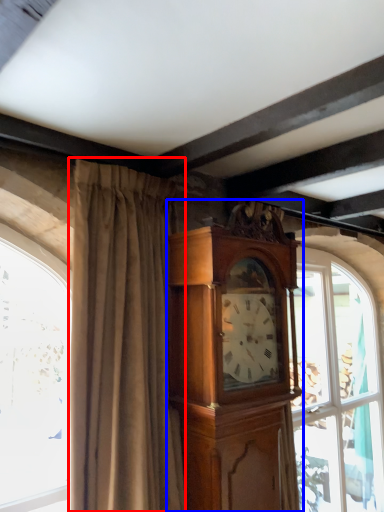
Question: Which object appears farthest to the camera in this image, curtain (highlighted by a red box) or cabinetry (highlighted by a blue box)?

Choices:
 (A) curtain
 (B) cabinetry

Answer: (B)